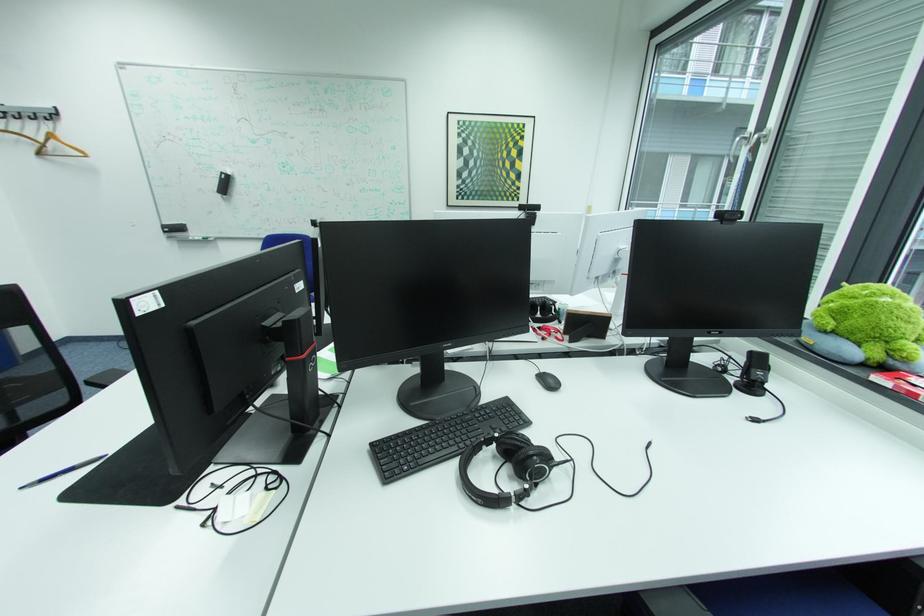
Where is `black microphone`? black microphone is located at coordinates (754, 373).